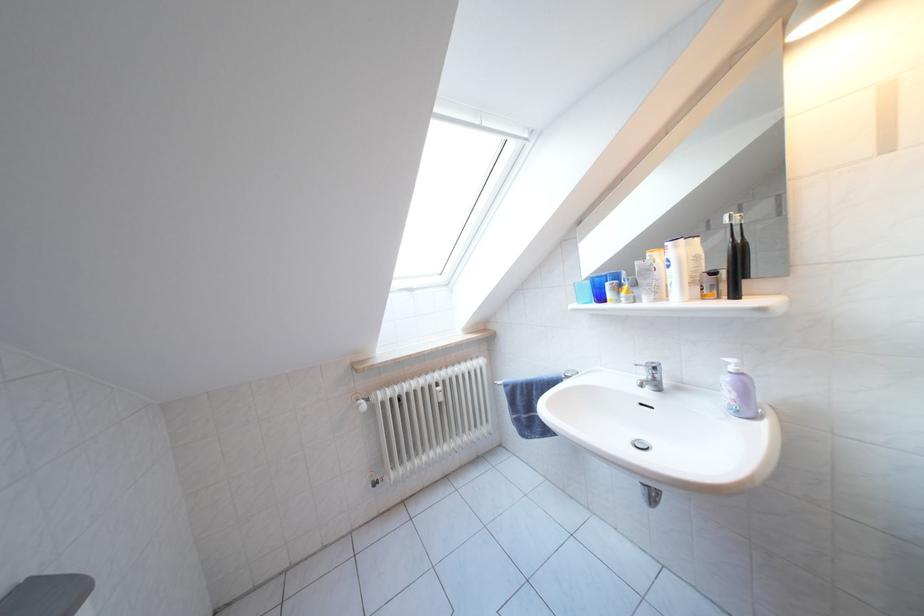
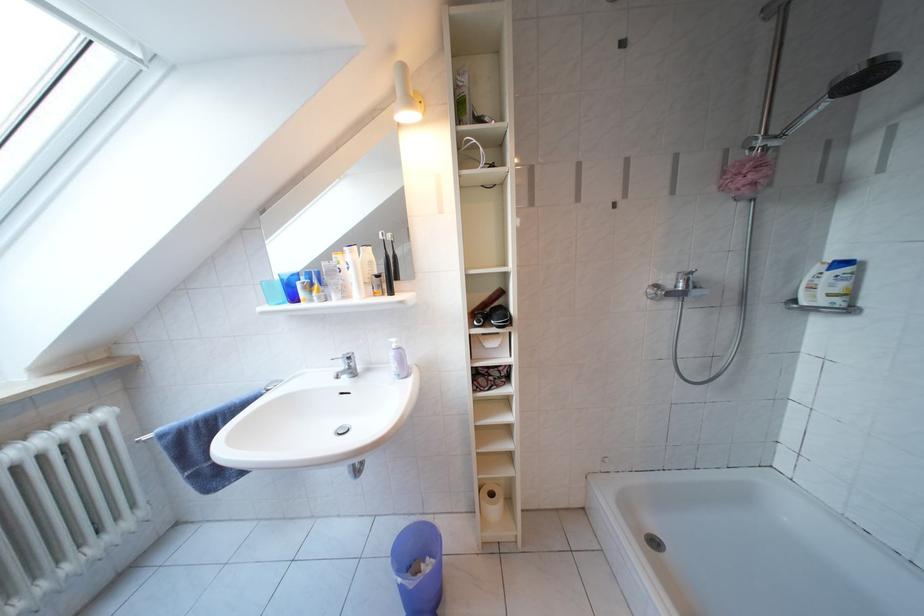
Find the pixel in the second image that matches [652,379] in the first image.

(349, 371)